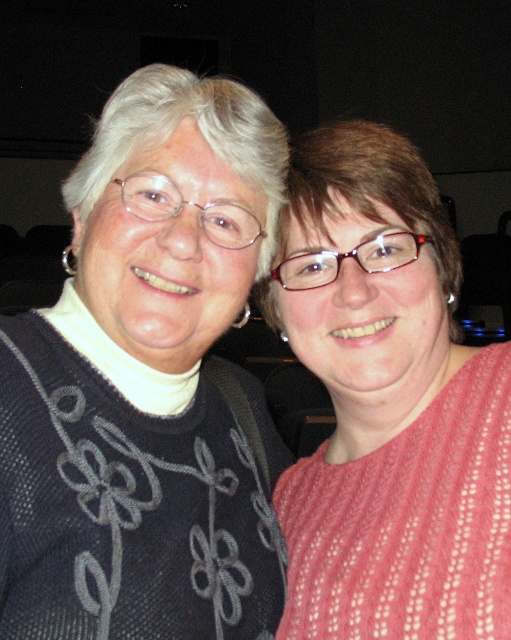
You are a photographer setting up for a group photo in a theater. You notice two sweaters in the scene, the dark gray knit sweater at left and the pink knitted sweater at center. Which sweater would block the view of the other if someone stands behind it?

The dark gray knit sweater at left is much taller than the pink knitted sweater at center, so it would block the view of the pink knitted sweater at center.